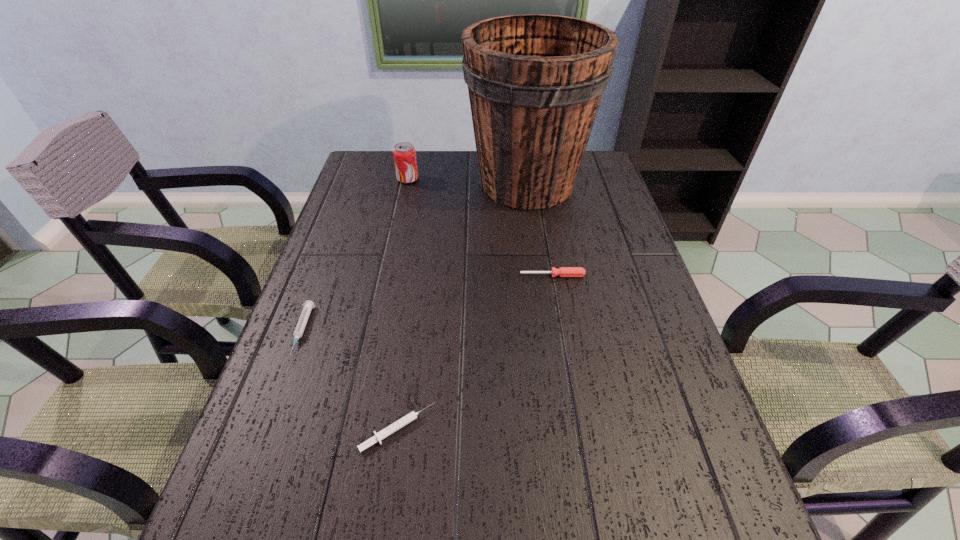
Where is `free space located 0.340m at the needle end of the taller syringe`? This screenshot has width=960, height=540. free space located 0.340m at the needle end of the taller syringe is located at coordinates (227, 532).

Find the location of a particular element. vacant area situated on the right of the shortest object is located at coordinates (549, 429).

Identify the location of bucket that is at the far edge. (535, 82).

Where is `soda can that is at the far edge`? The image size is (960, 540). soda can that is at the far edge is located at coordinates (404, 153).

The height and width of the screenshot is (540, 960). I want to click on soda can at the left edge, so point(404,153).

You are a GUI agent. You are given a task and a screenshot of the screen. Output one action in this format:
    pyautogui.click(x=<x>, y=<y>)
    Task: Click on the syringe located at the left edge
    The image size is (960, 540).
    Given the screenshot: What is the action you would take?
    pyautogui.click(x=308, y=305)

This screenshot has width=960, height=540. What are the coordinates of `bucket that is at the right edge` in the screenshot? It's located at (535, 82).

Locate an element on the screen. The image size is (960, 540). screwdriver present at the right edge is located at coordinates (562, 271).

Locate an element on the screen. object that is positioned at the far left corner is located at coordinates (404, 153).

Locate an element on the screen. This screenshot has width=960, height=540. object at the far right corner is located at coordinates (535, 82).